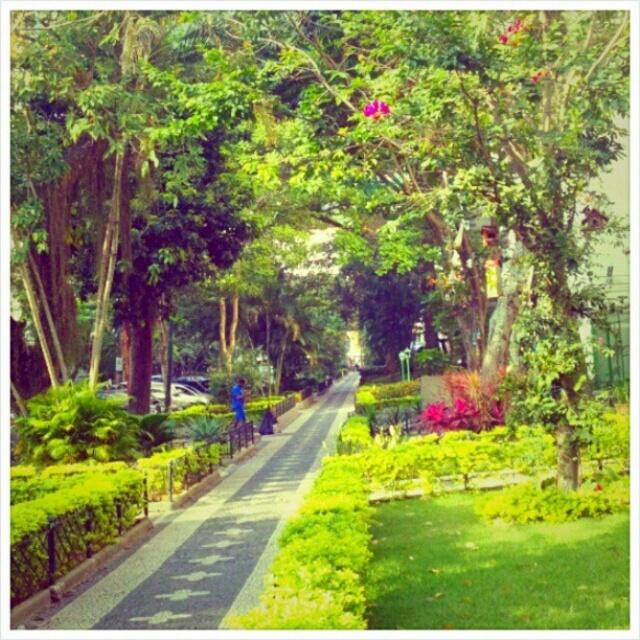
Question: Which object appears closest to the camera in this image?

Choices:
 (A) green leafy tree at center
 (B) green paved walkway at center

Answer: (B)

Question: Is green paved walkway at center positioned before pink matte flower at upper center?

Choices:
 (A) no
 (B) yes

Answer: (B)

Question: Estimate the real-world distances between objects in this image. Which object is farther from the pink matte flower at upper center?

Choices:
 (A) green paved walkway at center
 (B) green leafy tree at center

Answer: (B)

Question: Which point is farther to the camera?

Choices:
 (A) pink matte flower at upper center
 (B) green paved walkway at center
 (C) green leafy tree at center

Answer: (A)

Question: Does green leafy tree at center appear on the left side of pink matte flower at upper center?

Choices:
 (A) yes
 (B) no

Answer: (A)

Question: Considering the relative positions of green leafy tree at center and pink matte flower at upper center in the image provided, where is green leafy tree at center located with respect to pink matte flower at upper center?

Choices:
 (A) above
 (B) below

Answer: (A)